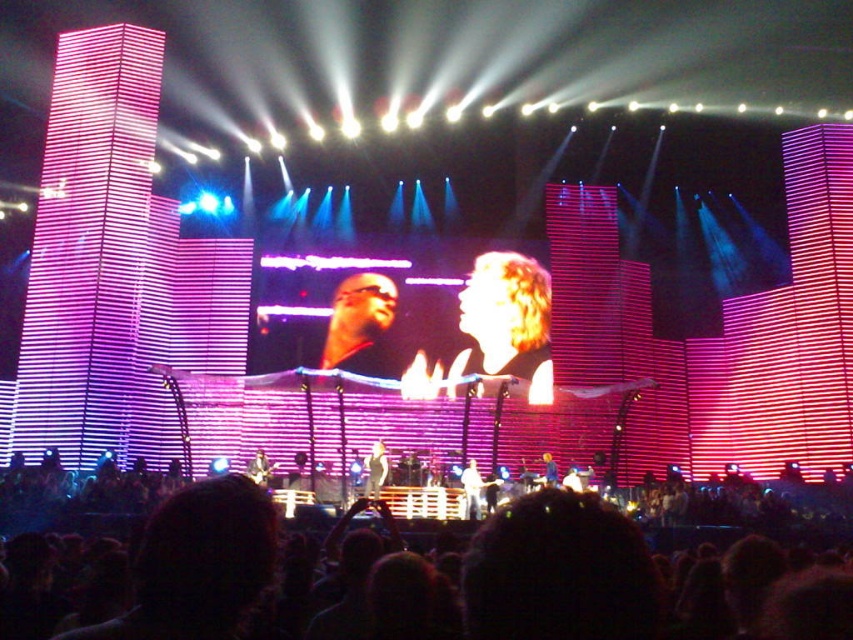
Can you confirm if white glossy microphone at center is smaller than smooth skin face at center?

No.

Measure the distance between point (363,470) and camera.

A distance of 83.12 meters exists between point (363,470) and camera.

Is point (380, 442) behind point (467, 461)?

Yes.

Locate an element on the screen. white glossy microphone at center is located at coordinates (375, 470).

Is matte black glasses at center closer to the viewer compared to smooth skin face at center?

No, matte black glasses at center is further to the viewer.

Which is in front, point (334, 328) or point (468, 477)?

Positioned in front is point (468, 477).

Between point (364, 339) and point (474, 509), which one is positioned behind?

Positioned behind is point (364, 339).

Where is `matte black glasses at center`? Image resolution: width=853 pixels, height=640 pixels. matte black glasses at center is located at coordinates (360, 324).

Is blonde hair at center to the right of white glossy microphone at center from the viewer's perspective?

Indeed, blonde hair at center is positioned on the right side of white glossy microphone at center.

Between point (462, 316) and point (378, 497), which one is positioned behind?

Positioned behind is point (462, 316).

What are the coordinates of `blonde hair at center` in the screenshot? It's located at tap(509, 317).